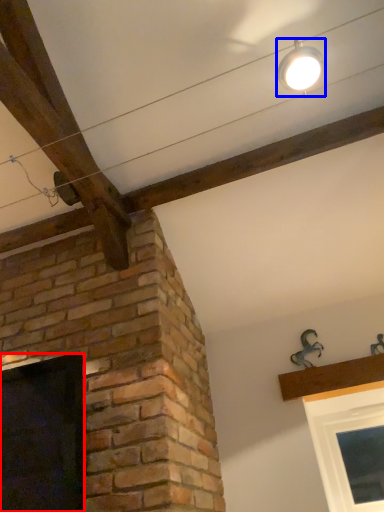
Question: Which point is further to the camera, window (highlighted by a red box) or light fixture (highlighted by a blue box)?

Choices:
 (A) window
 (B) light fixture

Answer: (A)